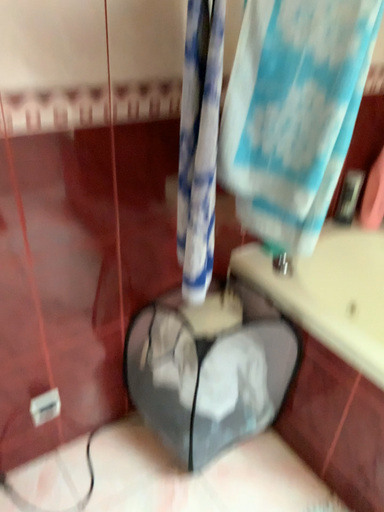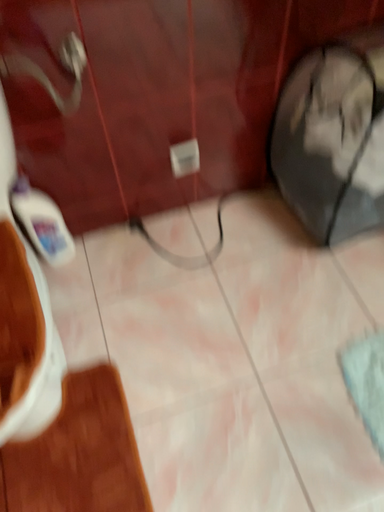
Question: How did the camera likely rotate when shooting the video?

Choices:
 (A) rotated downward
 (B) rotated upward

Answer: (A)